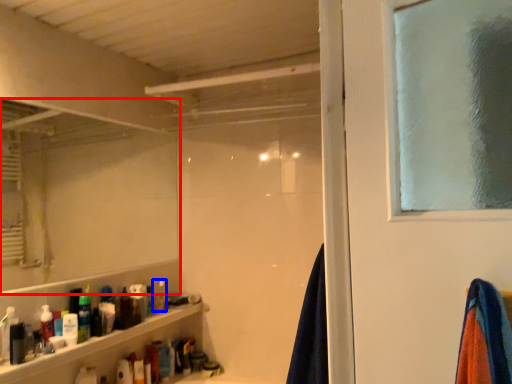
Question: Which point is further to the camera, mirror (highlighted by a red box) or toiletry (highlighted by a blue box)?

Choices:
 (A) mirror
 (B) toiletry

Answer: (B)